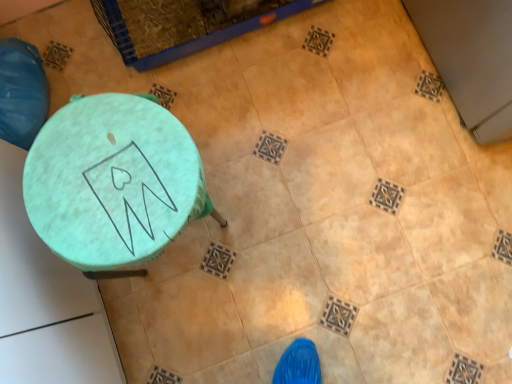
This screenshot has height=384, width=512. I want to click on blank space situated above teal fabric-covered stool at lower left (from a real-world perspective), so tap(117, 170).